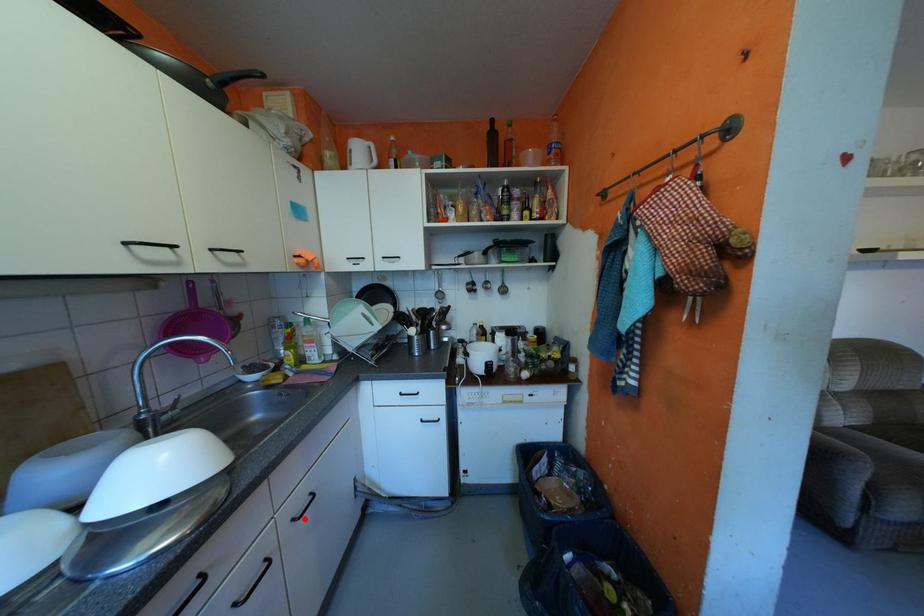
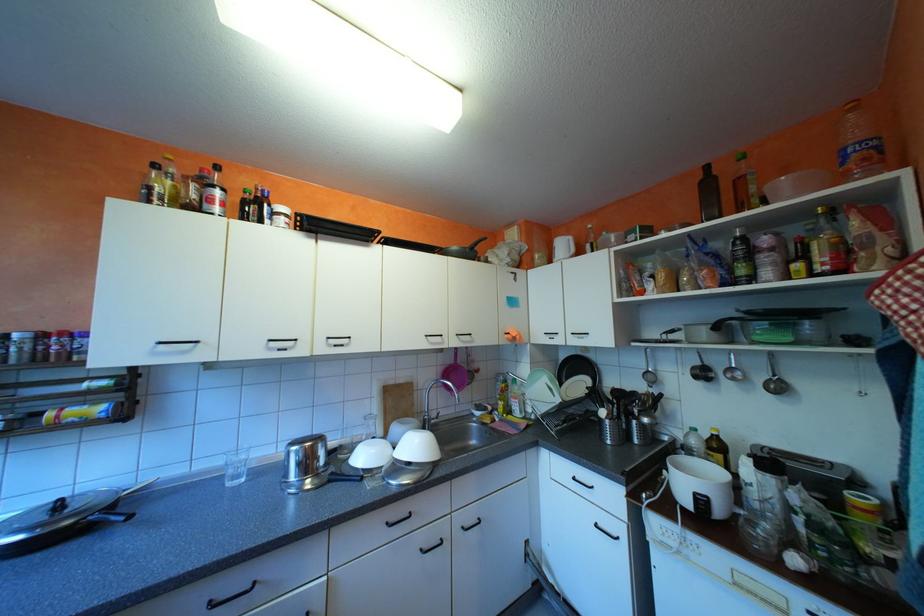
Find the pixel in the second image that matches the highlighted location in the first image.

(475, 527)